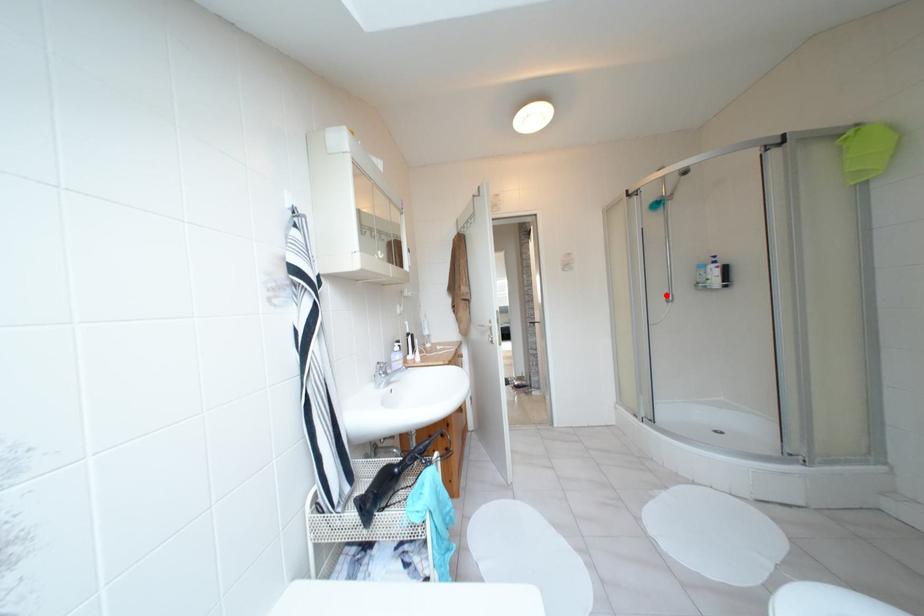
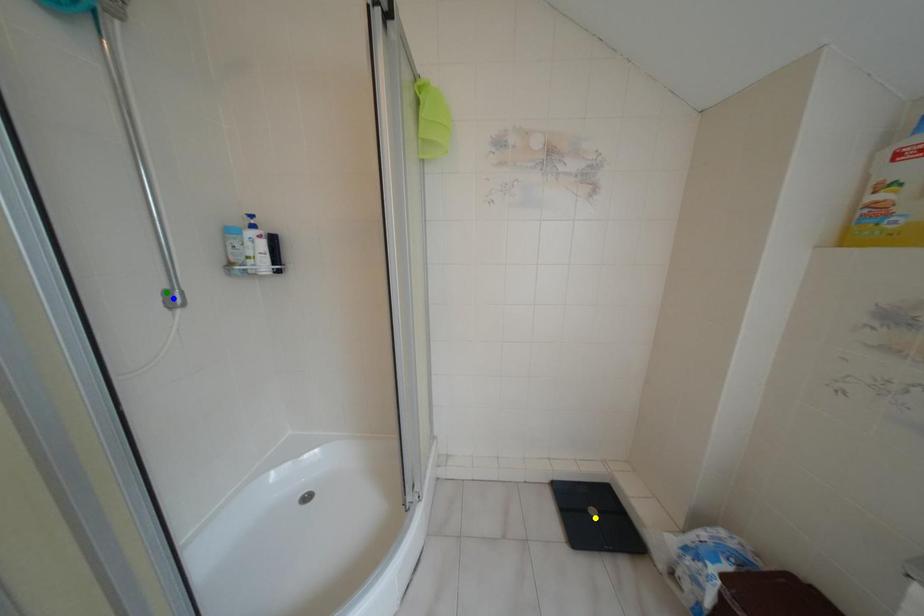
Question: I am providing you with two images of the same scene from different viewpoints. A red point is marked on the first image. You are given multiple points on the second image. In image 2, which mark is for the same physical point as the one in image 1?

Choices:
 (A) yellow point
 (B) blue point
 (C) green point

Answer: (C)